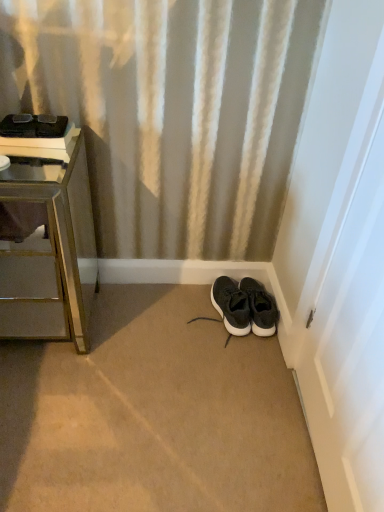
The height and width of the screenshot is (512, 384). Find the location of `free location in front of black fabric sneakers at center, the first footwear viewed from the left`. free location in front of black fabric sneakers at center, the first footwear viewed from the left is located at coordinates (231, 349).